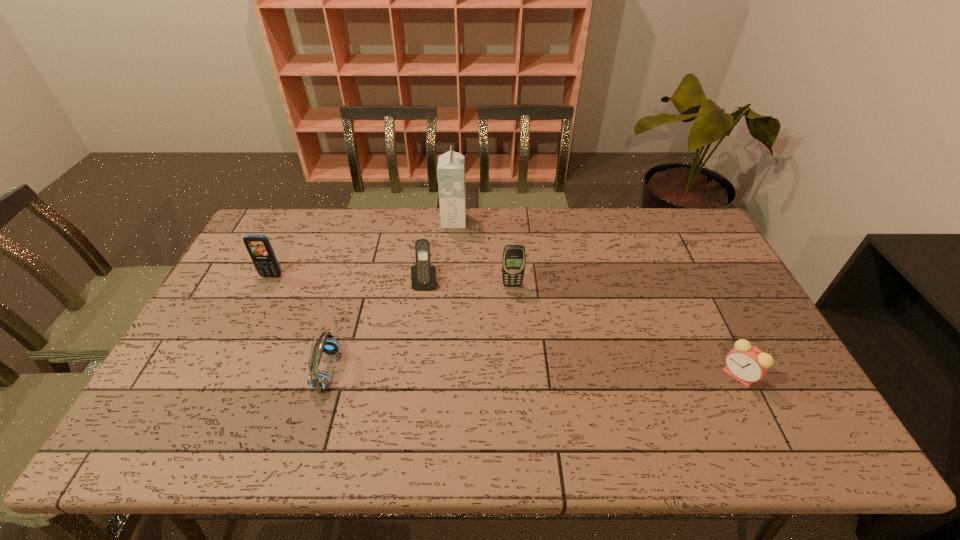
The height and width of the screenshot is (540, 960). In order to click on vacant space at the left edge of the desktop in this screenshot , I will do `click(222, 334)`.

This screenshot has width=960, height=540. Identify the location of free region at the right edge. (739, 390).

At what (x,y) coordinates should I click in order to perform the action: click on blank space at the far left corner of the desktop. Please return your answer as a coordinate pair (x, y). Looking at the image, I should click on (285, 213).

What are the coordinates of `vacant space at the near left corner of the desktop` in the screenshot? It's located at (156, 453).

This screenshot has height=540, width=960. What are the coordinates of `vacant space at the near right corner of the desktop` in the screenshot? It's located at (837, 455).

At what (x,y) coordinates should I click in order to perform the action: click on free spot between the farthest object and the second cellular telephone from right to left. Please return your answer as a coordinate pair (x, y). This screenshot has width=960, height=540. Looking at the image, I should click on (440, 252).

Image resolution: width=960 pixels, height=540 pixels. What are the coordinates of `free space between the leftmost cellular telephone and the carton` in the screenshot? It's located at (363, 249).

Locate an element on the screen. This screenshot has width=960, height=540. free area in between the rightmost cellular telephone and the second cellular telephone from left to right is located at coordinates (468, 284).

In order to click on empty space between the rightmost object and the leftmost object in this screenshot , I will do `click(505, 326)`.

You are a GUI agent. You are given a task and a screenshot of the screen. Output one action in this format:
    pyautogui.click(x=<x>, y=<y>)
    Task: Click on the empty space that is in between the leftmost object and the fifth object from left to right
    This screenshot has height=540, width=960.
    Given the screenshot: What is the action you would take?
    pyautogui.click(x=392, y=281)